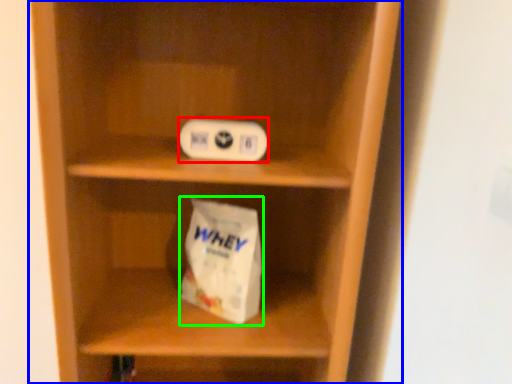
Question: Considering the real-world distances, which object is closest to ipod (highlighted by a red box)? shelf (highlighted by a blue box) or paper bag (highlighted by a green box).

Choices:
 (A) shelf
 (B) paper bag

Answer: (B)